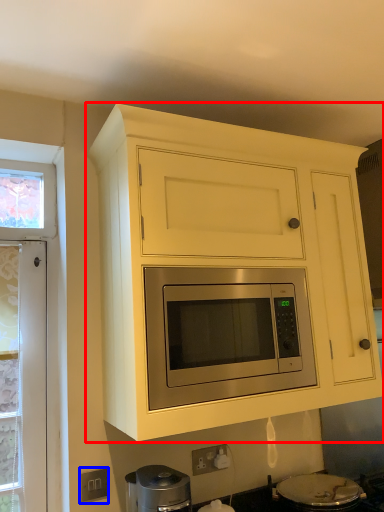
Question: Which of the following is the closest to the observer, cabinetry (highlighted by a red box) or electric outlet (highlighted by a blue box)?

Choices:
 (A) cabinetry
 (B) electric outlet

Answer: (A)